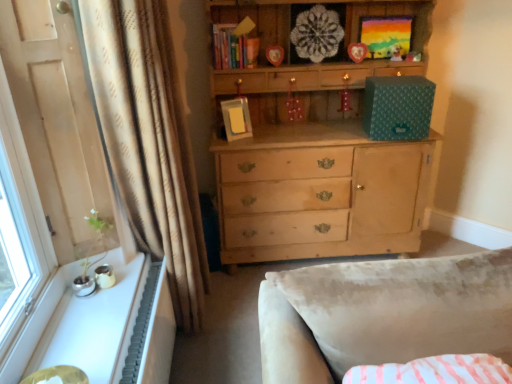
Question: From the image's perspective, is plush yellow teddy bear at upper center located beneath white textured radiator at lower left?

Choices:
 (A) yes
 (B) no

Answer: (B)

Question: Is plush yellow teddy bear at upper center wider than white textured radiator at lower left?

Choices:
 (A) no
 (B) yes

Answer: (A)

Question: From a real-world perspective, is plush yellow teddy bear at upper center below white textured radiator at lower left?

Choices:
 (A) yes
 (B) no

Answer: (B)

Question: Is plush yellow teddy bear at upper center positioned in front of white textured radiator at lower left?

Choices:
 (A) no
 (B) yes

Answer: (A)

Question: Is plush yellow teddy bear at upper center directly adjacent to white textured radiator at lower left?

Choices:
 (A) no
 (B) yes

Answer: (A)

Question: Considering their positions, is beige textured curtain at left located in front of or behind white glossy windowsill at lower left?

Choices:
 (A) behind
 (B) front

Answer: (A)

Question: Is beige textured curtain at left to the left or to the right of white glossy windowsill at lower left in the image?

Choices:
 (A) right
 (B) left

Answer: (A)

Question: Considering the positions of beige textured curtain at left and white glossy windowsill at lower left in the image, is beige textured curtain at left wider or thinner than white glossy windowsill at lower left?

Choices:
 (A) wide
 (B) thin

Answer: (A)

Question: Looking at the image, does beige textured curtain at left seem bigger or smaller compared to white glossy windowsill at lower left?

Choices:
 (A) big
 (B) small

Answer: (A)

Question: Is beige textured curtain at left in front of or behind white textured radiator at lower left in the image?

Choices:
 (A) behind
 (B) front

Answer: (B)

Question: Considering the positions of point (124, 120) and point (172, 311), is point (124, 120) closer or farther from the camera than point (172, 311)?

Choices:
 (A) closer
 (B) farther

Answer: (A)

Question: Looking at the image, does beige textured curtain at left seem bigger or smaller compared to white textured radiator at lower left?

Choices:
 (A) big
 (B) small

Answer: (A)

Question: From the image's perspective, relative to white textured radiator at lower left, is beige textured curtain at left above or below?

Choices:
 (A) above
 (B) below

Answer: (A)

Question: From a real-world perspective, relative to white textured radiator at lower left, is matte yellow book at upper center vertically above or below?

Choices:
 (A) above
 (B) below

Answer: (A)

Question: Considering their positions, is matte yellow book at upper center located in front of or behind white textured radiator at lower left?

Choices:
 (A) behind
 (B) front

Answer: (A)